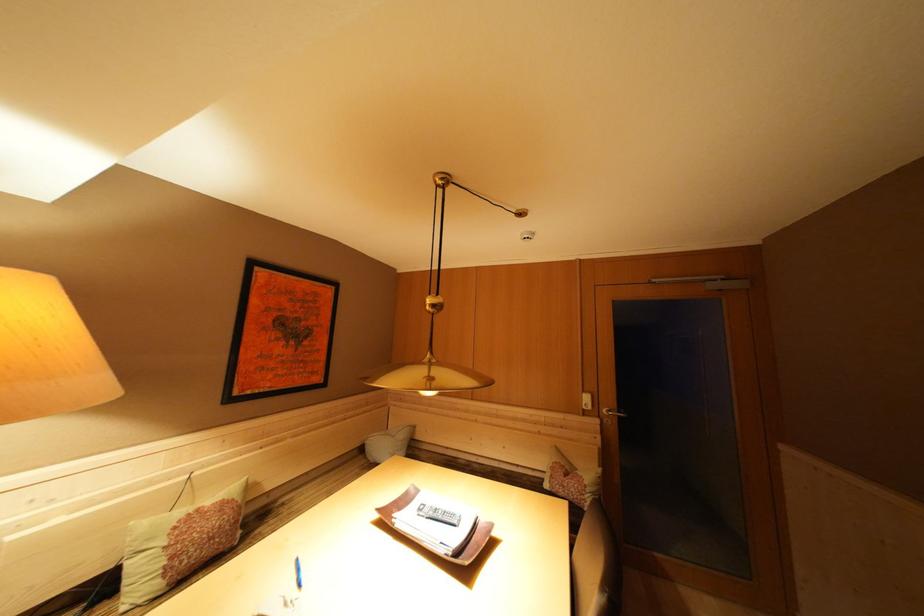
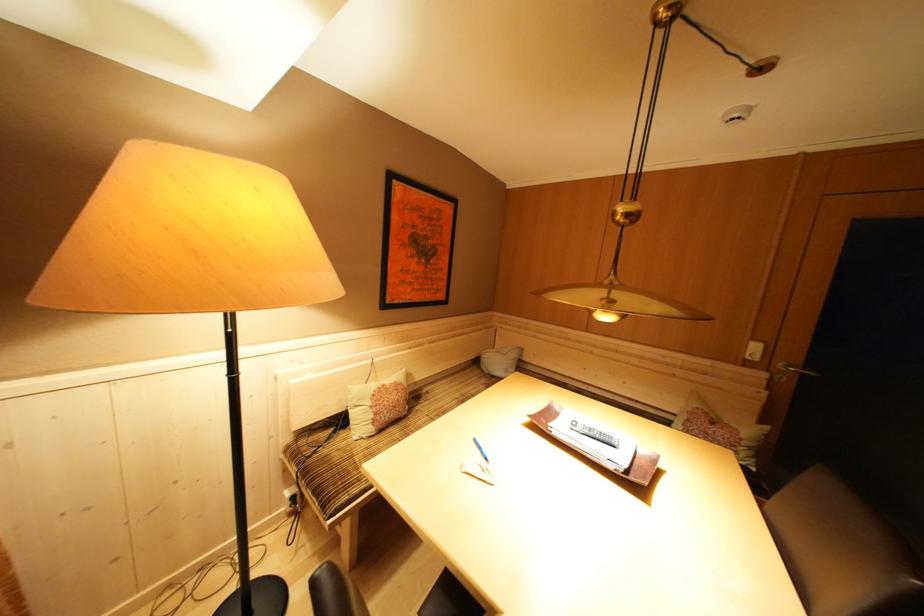
First-person continuous shooting, in which direction is the camera rotating?

The camera's rotation is toward left-down.